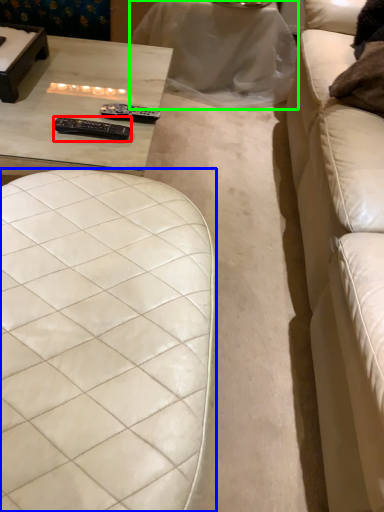
Question: Based on their relative distances, which object is nearer to remote (highlighted by a red box)? Choose from furniture (highlighted by a blue box) and table (highlighted by a green box).

Choices:
 (A) furniture
 (B) table

Answer: (A)